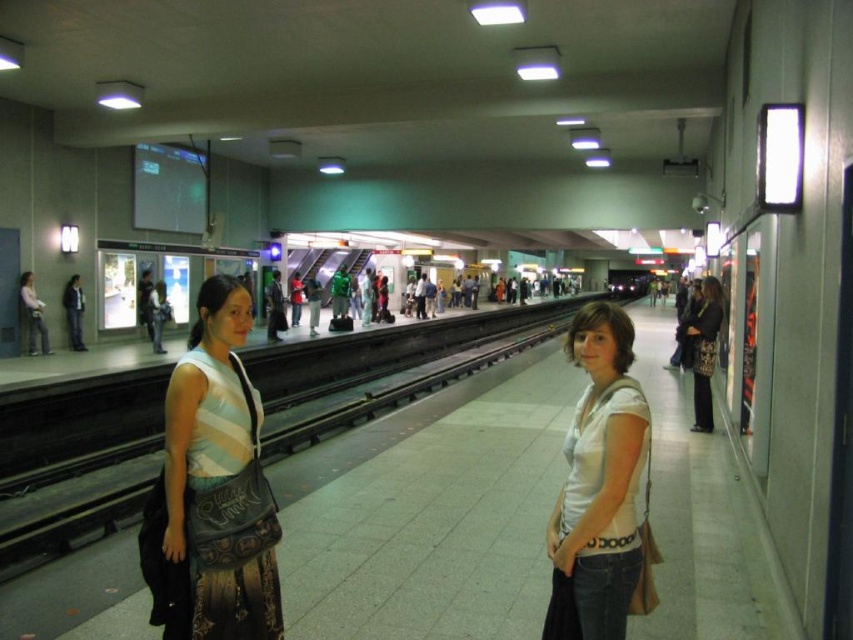
Question: Which object is the closest to the white cotton shirt at center?

Choices:
 (A) matte black jacket at center
 (B) matte black bag at left

Answer: (B)

Question: Does matte black bag at left appear on the left side of white cotton shirt at center?

Choices:
 (A) yes
 (B) no

Answer: (A)

Question: Does matte black bag at left come in front of matte black jacket at center?

Choices:
 (A) yes
 (B) no

Answer: (A)

Question: Which point is farther to the camera?

Choices:
 (A) matte black bag at left
 (B) white cotton shirt at center
 (C) matte black jacket at center

Answer: (C)

Question: Is matte black bag at left below matte black jacket at center?

Choices:
 (A) yes
 (B) no

Answer: (A)

Question: Which object is farther from the camera taking this photo?

Choices:
 (A) matte black bag at left
 (B) white cotton shirt at center
 (C) matte black jacket at center

Answer: (C)